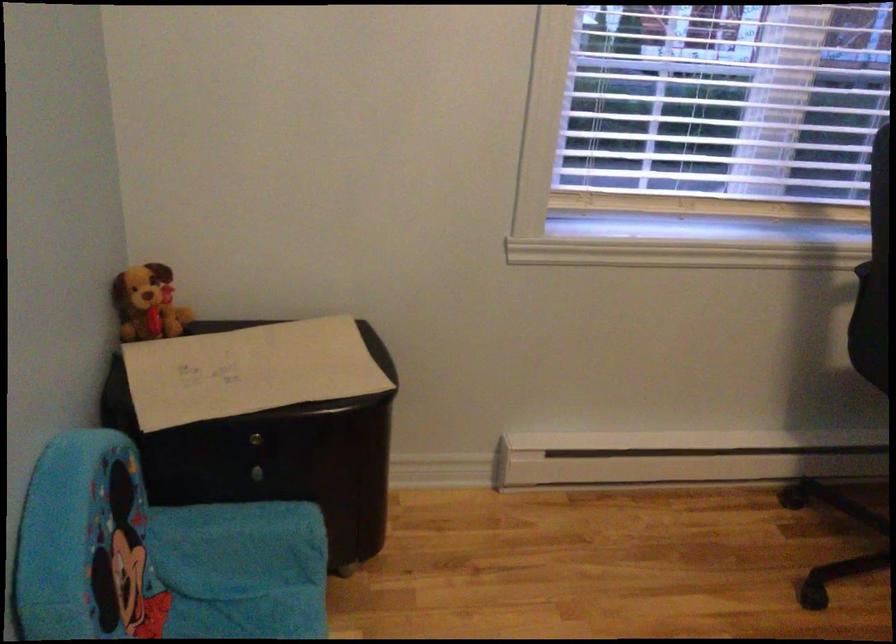
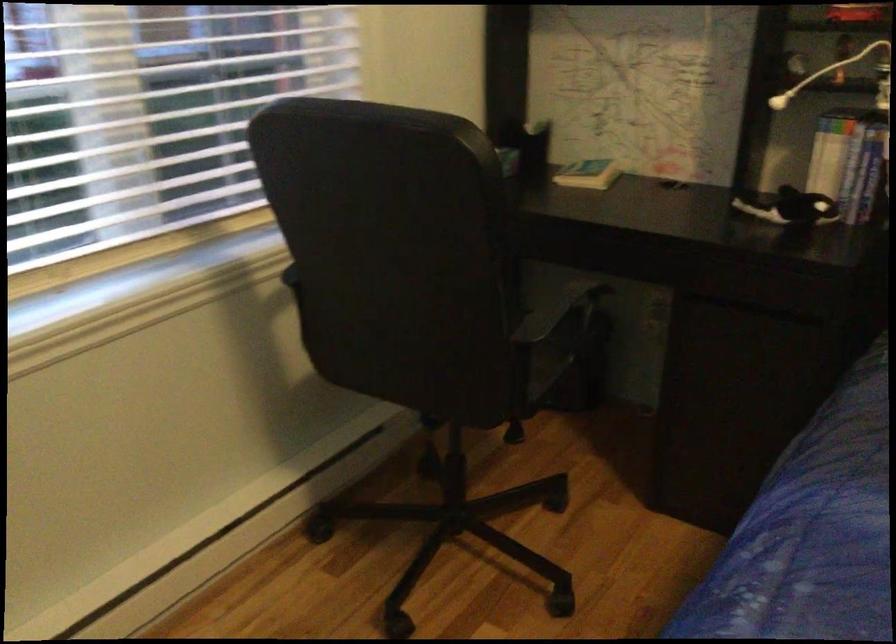
Question: The images are taken continuously from a first-person perspective. In which direction is your viewpoint rotating?

Choices:
 (A) Left
 (B) Right
 (C) Up
 (D) Down

Answer: (B)